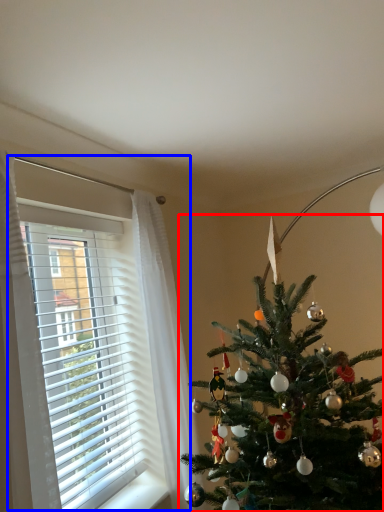
Question: Which object is closer to the camera taking this photo, christmas tree (highlighted by a red box) or window (highlighted by a blue box)?

Choices:
 (A) christmas tree
 (B) window

Answer: (B)